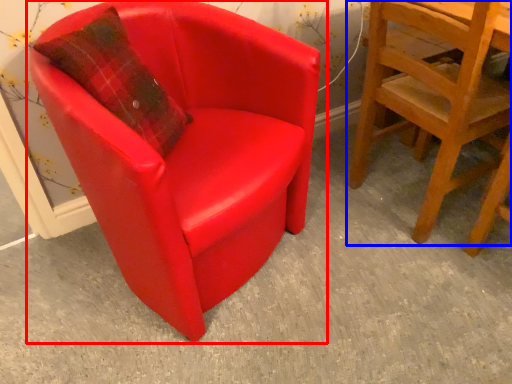
Question: Which of the following is the closest to the observer, chair (highlighted by a red box) or chair (highlighted by a blue box)?

Choices:
 (A) chair
 (B) chair

Answer: (A)